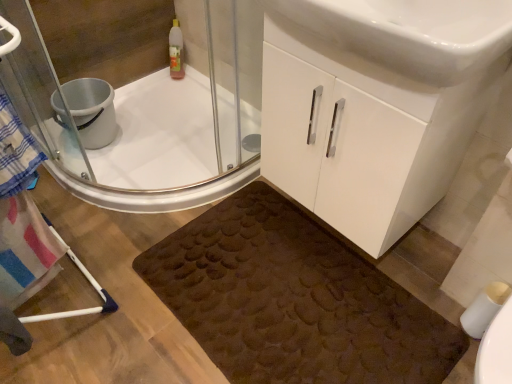
Find the location of a particular element. This screenshot has width=512, height=384. white glossy sink at center is located at coordinates (411, 33).

At what (x,y) coordinates should I click in order to perform the action: click on clear glass shower door at upper left. Please return your answer as a coordinate pair (x, y). The width and height of the screenshot is (512, 384). Looking at the image, I should click on (154, 116).

What do you see at coordinates (296, 300) in the screenshot? I see `brown textured bath mat at lower center` at bounding box center [296, 300].

Locate an element on the screen. The image size is (512, 384). white glossy sink at center is located at coordinates (411, 33).

Relative to white matte toilet paper at lower right, is brown textured bath mat at lower center in front or behind?

In the image, brown textured bath mat at lower center appears in front of white matte toilet paper at lower right.

Which is closer to the camera, (350, 253) or (500, 305)?

Point (350, 253) is positioned farther from the camera compared to point (500, 305).

From a real-world perspective, is brown textured bath mat at lower center physically above white matte toilet paper at lower right?

No, from a real-world perspective, brown textured bath mat at lower center is not above white matte toilet paper at lower right.

Is brown textured bath mat at lower center positioned beyond the bounds of white matte toilet paper at lower right?

Yes, brown textured bath mat at lower center is located beyond the bounds of white matte toilet paper at lower right.

Considering the relative sizes of white glossy cabinet at center and silver metallic bucket at upper left in the image provided, is white glossy cabinet at center taller than silver metallic bucket at upper left?

Yes, white glossy cabinet at center is taller than silver metallic bucket at upper left.

Where is `bathroom cabinet in front of the silver metallic bucket at upper left`? bathroom cabinet in front of the silver metallic bucket at upper left is located at coordinates (377, 104).

Is white glossy cabinet at center bigger than silver metallic bucket at upper left?

Yes.

Measure the distance between white glossy cabinet at center and silver metallic bucket at upper left.

white glossy cabinet at center is 3.51 feet away from silver metallic bucket at upper left.

Is white matte toilet paper at lower right at the left side of white glossy cabinet at center?

In fact, white matte toilet paper at lower right is to the right of white glossy cabinet at center.

From a real-world perspective, who is located higher, white matte toilet paper at lower right or white glossy cabinet at center?

white glossy cabinet at center is physically above.

Is white glossy cabinet at center surrounded by white matte toilet paper at lower right?

That's incorrect, white glossy cabinet at center is not inside white matte toilet paper at lower right.

Is white matte toilet paper at lower right oriented away from white glossy cabinet at center?

No, white glossy cabinet at center is not at the back of white matte toilet paper at lower right.

Based on the photo, is white matte toilet paper at lower right next to silver metallic bucket at upper left and touching it?

No, white matte toilet paper at lower right is not making contact with silver metallic bucket at upper left.

Considering the sizes of objects white matte toilet paper at lower right and silver metallic bucket at upper left in the image provided, who is taller, white matte toilet paper at lower right or silver metallic bucket at upper left?

Standing taller between the two is silver metallic bucket at upper left.

Is white matte toilet paper at lower right oriented away from silver metallic bucket at upper left?

No, white matte toilet paper at lower right is not facing away from silver metallic bucket at upper left.

Which object is closer to the camera, white matte toilet paper at lower right or silver metallic bucket at upper left?

white matte toilet paper at lower right is more forward.

What's the angular difference between white glossy sink at center and white glossy cabinet at center's facing directions?

The angle between the facing direction of white glossy sink at center and the facing direction of white glossy cabinet at center is 0.0203 degrees.

Is white glossy sink at center inside or outside of white glossy cabinet at center?

white glossy sink at center cannot be found inside white glossy cabinet at center.

Who is more distant, white glossy sink at center or white glossy cabinet at center?

Positioned behind is white glossy cabinet at center.

Can you confirm if white glossy sink at center is positioned to the right of white glossy cabinet at center?

No, white glossy sink at center is not to the right of white glossy cabinet at center.

Which point is more forward, (378, 359) or (394, 90)?

The point (394, 90) is closer to the camera.

Is brown textured bath mat at lower center positioned with its back to white glossy cabinet at center?

That's not correct — brown textured bath mat at lower center is not looking away from white glossy cabinet at center.

Is brown textured bath mat at lower center thinner than white glossy cabinet at center?

No.

From a real-world perspective, relative to white glossy cabinet at center, is brown textured bath mat at lower center vertically above or below?

From a real-world perspective, brown textured bath mat at lower center is physically below white glossy cabinet at center.

Is white glossy cabinet at center at the left side of white matte toilet paper at lower right?

Correct, you'll find white glossy cabinet at center to the left of white matte toilet paper at lower right.

Can you tell me how much white glossy cabinet at center and white matte toilet paper at lower right differ in facing direction?

The angle between the facing direction of white glossy cabinet at center and the facing direction of white matte toilet paper at lower right is 9.61 degrees.

Can you confirm if white glossy cabinet at center is taller than white matte toilet paper at lower right?

Yes, white glossy cabinet at center is taller than white matte toilet paper at lower right.

Is white glossy cabinet at center situated inside white matte toilet paper at lower right or outside?

white glossy cabinet at center is spatially situated outside white matte toilet paper at lower right.

Find the location of a particular element. The image size is (512, 384). toilet paper behind the brown textured bath mat at lower center is located at coordinates (484, 309).

Where is `bathroom cabinet above the silver metallic bucket at upper left (from a real-world perspective)`? bathroom cabinet above the silver metallic bucket at upper left (from a real-world perspective) is located at coordinates (377, 104).

When comparing their distances from white glossy cabinet at center, does brown textured bath mat at lower center or white matte toilet paper at lower right seem further?

Among the two, white matte toilet paper at lower right is located further to white glossy cabinet at center.

Considering their positions, is clear glass shower door at upper left positioned closer to silver metallic bucket at upper left than white glossy sink at center?

The object closer to silver metallic bucket at upper left is clear glass shower door at upper left.

Based on their spatial positions, is white matte toilet paper at lower right or white glossy sink at center further from brown textured bath mat at lower center?

The object further to brown textured bath mat at lower center is white glossy sink at center.

Based on the photo, from the image, which object appears to be nearer to white matte toilet paper at lower right, brown textured bath mat at lower center or white glossy sink at center?

brown textured bath mat at lower center.

Based on their spatial positions, is white glossy cabinet at center or white glossy sink at center closer to silver metallic bucket at upper left?

Based on the image, white glossy cabinet at center appears to be nearer to silver metallic bucket at upper left.

Looking at the image, which one is located closer to white glossy sink at center, silver metallic bucket at upper left or brown textured bath mat at lower center?

The object closer to white glossy sink at center is brown textured bath mat at lower center.

From the image, which object appears to be farther from brown textured bath mat at lower center, silver metallic bucket at upper left or white glossy sink at center?

silver metallic bucket at upper left is positioned further to the anchor brown textured bath mat at lower center.

From the image, which object appears to be farther from clear glass shower door at upper left, brown textured bath mat at lower center or silver metallic bucket at upper left?

Among the two, brown textured bath mat at lower center is located further to clear glass shower door at upper left.

Locate an element on the screen. shower door located between silver metallic bucket at upper left and brown textured bath mat at lower center in the left-right direction is located at coordinates (154, 116).

Locate an element on the screen. This screenshot has height=384, width=512. bath mat between clear glass shower door at upper left and white matte toilet paper at lower right from left to right is located at coordinates (296, 300).

At what (x,y) coordinates should I click in order to perform the action: click on shower door situated between silver metallic bucket at upper left and white glossy cabinet at center from left to right. Please return your answer as a coordinate pair (x, y). The width and height of the screenshot is (512, 384). Looking at the image, I should click on (154, 116).

Identify the location of bath mat between white glossy cabinet at center and white matte toilet paper at lower right in the vertical direction. Image resolution: width=512 pixels, height=384 pixels. (296, 300).